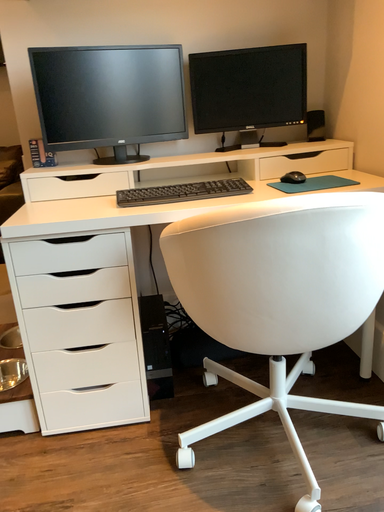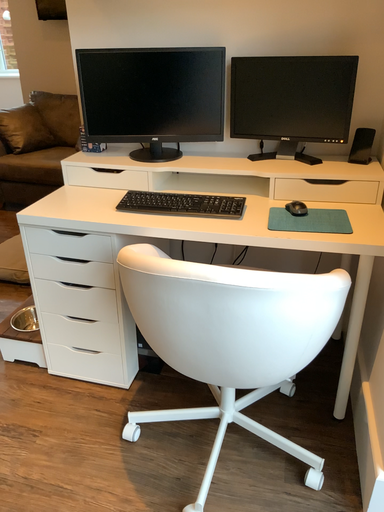
Question: How did the camera likely rotate when shooting the video?

Choices:
 (A) rotated upward
 (B) rotated downward

Answer: (B)